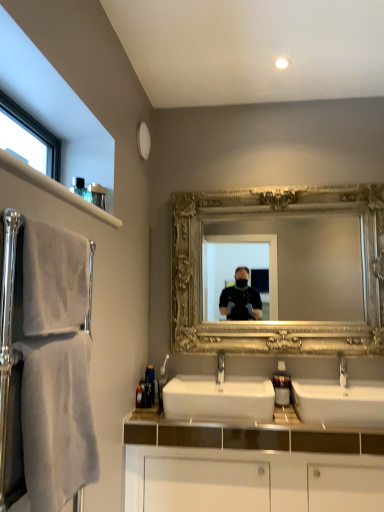
Question: From the image's perspective, is gold ornate mirror at center positioned above or below silver metallic faucet at center?

Choices:
 (A) above
 (B) below

Answer: (A)

Question: From a real-world perspective, relative to silver metallic faucet at center, is gold ornate mirror at center vertically above or below?

Choices:
 (A) above
 (B) below

Answer: (A)

Question: Considering the real-world distances, which object is closest to the clear glass window at upper left?

Choices:
 (A) white ceramic sink at center, which appears as the second sink when viewed from the right
 (B) translucent plastic bottle at lower left, acting as the 1th toiletry starting from the back
 (C) white soft towel at left, marked as the 2th bath towel in a top-to-bottom arrangement
 (D) white textured towel at left, which is counted as the 2th bath towel, starting from the bottom
 (E) white glossy cabinet at center

Answer: (D)

Question: Which is nearer to the translucent plastic soap dispenser at center?

Choices:
 (A) white textured towel at left, the 1th bath towel in the top-to-bottom sequence
 (B) white glossy cabinet at center
 (C) clear glass window at upper left
 (D) gold ornate mirror at center
 (E) white ceramic sink at center, which is counted as the 1th sink, starting from the right

Answer: (E)